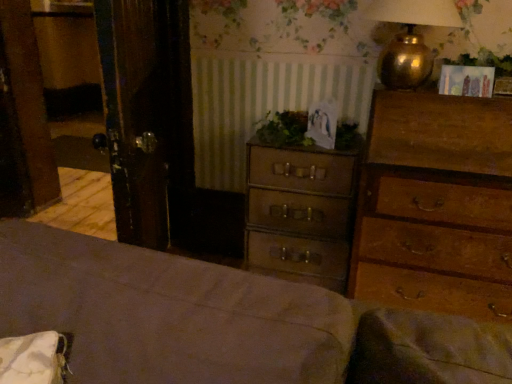
This screenshot has height=384, width=512. Identify the location of free area below green leafy plant at center, arranged as the 2th plant when viewed from the right (from a real-world perspective). (271, 144).